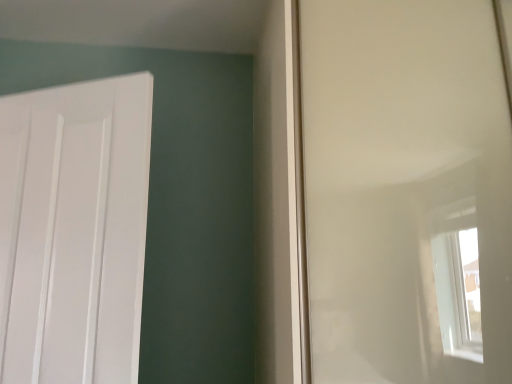
Describe the element at coordinates (74, 231) in the screenshot. I see `white matte door at left` at that location.

You are a GUI agent. You are given a task and a screenshot of the screen. Output one action in this format:
    pyautogui.click(x=<x>, y=<y>)
    Task: Click on the white matte door at left
    Image resolution: width=512 pixels, height=384 pixels.
    Given the screenshot: What is the action you would take?
    pyautogui.click(x=74, y=231)

What is the approximate height of white matte door at left?

The height of white matte door at left is 38.31 inches.

Image resolution: width=512 pixels, height=384 pixels. Describe the element at coordinates (406, 191) in the screenshot. I see `transparent plastic window screen at right` at that location.

The image size is (512, 384). I want to click on transparent plastic window screen at right, so click(x=406, y=191).

Image resolution: width=512 pixels, height=384 pixels. I want to click on white matte door at left, so click(74, 231).

Between transparent plastic window screen at right and white matte door at left, which one appears on the left side from the viewer's perspective?

white matte door at left.

Which object is closer to the camera taking this photo, transparent plastic window screen at right or white matte door at left?

transparent plastic window screen at right.

Considering the positions of point (322, 292) and point (106, 144), is point (322, 292) closer or farther from the camera than point (106, 144)?

Point (322, 292).

From the image's perspective, which one is positioned higher, transparent plastic window screen at right or white matte door at left?

transparent plastic window screen at right, from the image's perspective.

From a real-world perspective, is transparent plastic window screen at right located beneath white matte door at left?

No, from a real-world perspective, transparent plastic window screen at right is not beneath white matte door at left.

Does transparent plastic window screen at right have a greater width compared to white matte door at left?

Yes, transparent plastic window screen at right is wider than white matte door at left.

Considering the sizes of objects transparent plastic window screen at right and white matte door at left in the image provided, who is shorter, transparent plastic window screen at right or white matte door at left?

With less height is white matte door at left.

Considering the sizes of objects transparent plastic window screen at right and white matte door at left in the image provided, who is bigger, transparent plastic window screen at right or white matte door at left?

transparent plastic window screen at right.

Which is correct: transparent plastic window screen at right is inside white matte door at left, or outside of it?

transparent plastic window screen at right is not enclosed by white matte door at left.

Would you say transparent plastic window screen at right is a long distance from white matte door at left?

No, there isn't a large distance between transparent plastic window screen at right and white matte door at left.

Does transparent plastic window screen at right turn towards white matte door at left?

No.

Find the location of `window screen on the right of the white matte door at left`. window screen on the right of the white matte door at left is located at coordinates (406, 191).

Based on the photo, which object is positioned more to the right, white matte door at left or transparent plastic window screen at right?

From the viewer's perspective, transparent plastic window screen at right appears more on the right side.

Relative to transparent plastic window screen at right, is white matte door at left in front or behind?

Clearly, white matte door at left is behind transparent plastic window screen at right.

Is point (26, 228) positioned before point (418, 330)?

No, it is behind (418, 330).

From the image's perspective, between white matte door at left and transparent plastic window screen at right, who is located below?

From the image's view, white matte door at left is below.

From a real-world perspective, is white matte door at left located higher than transparent plastic window screen at right?

Incorrect, from a real-world perspective, white matte door at left is lower than transparent plastic window screen at right.

Between white matte door at left and transparent plastic window screen at right, which one has smaller width?

white matte door at left is thinner.

Who is taller, white matte door at left or transparent plastic window screen at right?

transparent plastic window screen at right is taller.

Between white matte door at left and transparent plastic window screen at right, which one has larger size?

With larger size is transparent plastic window screen at right.

Does white matte door at left contain transparent plastic window screen at right?

No, transparent plastic window screen at right is not surrounded by white matte door at left.

Are white matte door at left and transparent plastic window screen at right located far from each other?

white matte door at left is near transparent plastic window screen at right, not far away.

Is white matte door at left looking in the opposite direction of transparent plastic window screen at right?

No.

The width and height of the screenshot is (512, 384). What are the coordinates of `door behind the transparent plastic window screen at right` in the screenshot? It's located at (74, 231).

At what (x,y) coordinates should I click in order to perform the action: click on door lying behind the transparent plastic window screen at right. Please return your answer as a coordinate pair (x, y). This screenshot has height=384, width=512. Looking at the image, I should click on point(74,231).

You are a GUI agent. You are given a task and a screenshot of the screen. Output one action in this format:
    pyautogui.click(x=<x>, y=<y>)
    Task: Click on the door located on the left of transparent plastic window screen at right
    Image resolution: width=512 pixels, height=384 pixels.
    Given the screenshot: What is the action you would take?
    [x=74, y=231]